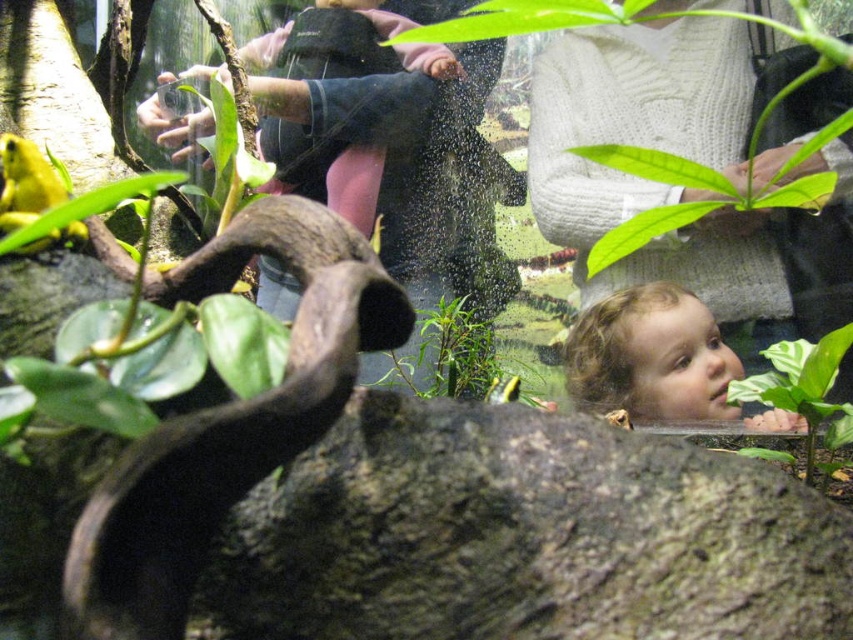
Between matte pink sweater at upper center and green leafy plant at lower right, which one has less height?

green leafy plant at lower right is shorter.

Can you confirm if matte pink sweater at upper center is smaller than green leafy plant at lower right?

Incorrect, matte pink sweater at upper center is not smaller in size than green leafy plant at lower right.

Where is `matte pink sweater at upper center`? The height and width of the screenshot is (640, 853). matte pink sweater at upper center is located at coordinates (344, 104).

The image size is (853, 640). I want to click on matte pink sweater at upper center, so click(344, 104).

Can you confirm if brown matte snake at left is thinner than light brown hair at center?

Yes.

Which is more to the left, brown matte snake at left or light brown hair at center?

Positioned to the left is brown matte snake at left.

Is point (224, 241) farther from viewer compared to point (677, 368)?

No, it is in front of (677, 368).

Find the location of a particular element. The height and width of the screenshot is (640, 853). brown matte snake at left is located at coordinates (227, 422).

Who is more forward, (325, 131) or (595, 410)?

Positioned in front is point (595, 410).

Who is taller, matte pink sweater at upper center or light brown hair at center?

matte pink sweater at upper center is taller.

Looking at this image, who is more forward, (270, 266) or (608, 339)?

Point (608, 339)

Where is `matte pink sweater at upper center`? The image size is (853, 640). matte pink sweater at upper center is located at coordinates [344, 104].